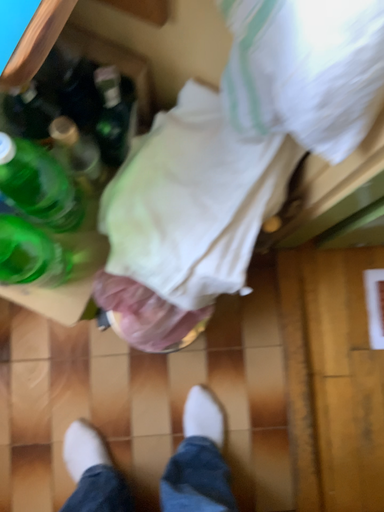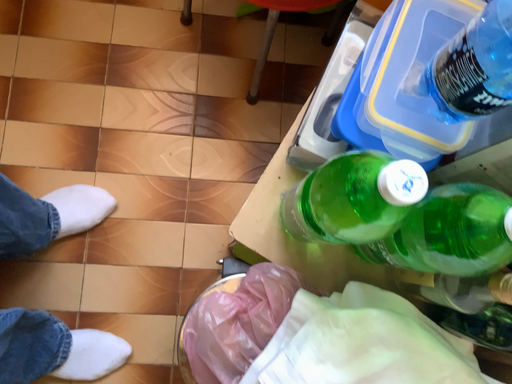
Question: Which way did the camera rotate in the video?

Choices:
 (A) rotated downward
 (B) rotated upward

Answer: (B)